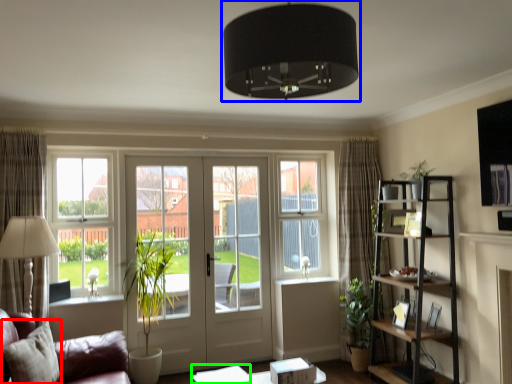
Question: Estimate the real-world distances between objects in this image. Which object is farther from pillow (highlighted by a red box), lamp (highlighted by a blue box) or table (highlighted by a green box)?

Choices:
 (A) lamp
 (B) table

Answer: (A)